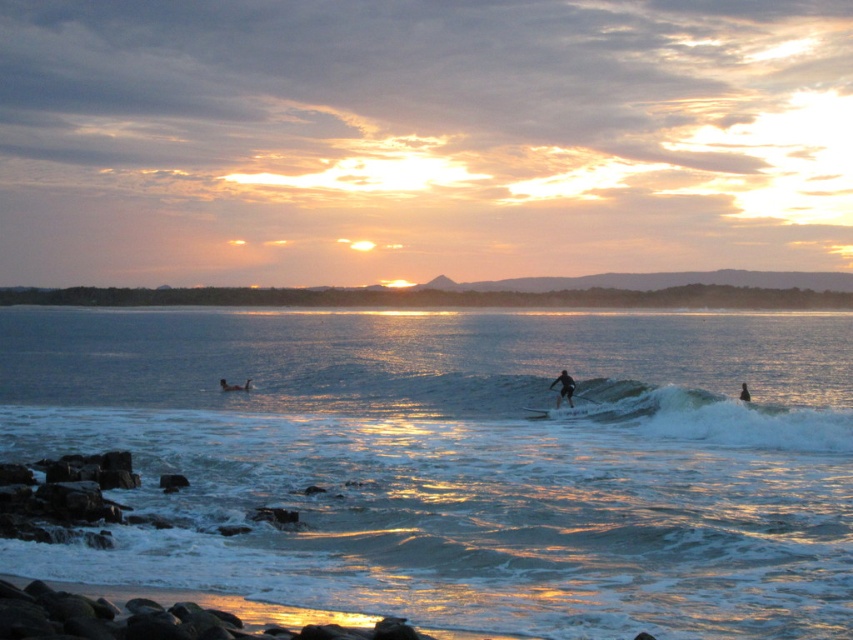
Which is behind, point (448, 346) or point (577, 408)?

Positioned behind is point (448, 346).

Does clear water at center have a greater height compared to white foam surfboard at center?

Yes.

Is point (61, 364) closer to viewer compared to point (564, 410)?

No, (61, 364) is behind (564, 410).

Where is `clear water at center`? This screenshot has width=853, height=640. clear water at center is located at coordinates (460, 461).

The height and width of the screenshot is (640, 853). I want to click on white foam surfboard at center, so click(561, 412).

Is white foam surfboard at center positioned behind smooth skin person at center?

No, white foam surfboard at center is closer to the viewer.

Is point (524, 408) more distant than point (245, 388)?

That is False.

You are a GUI agent. You are given a task and a screenshot of the screen. Output one action in this format:
    pyautogui.click(x=<x>, y=<y>)
    Task: Click on the white foam surfboard at center
    Image resolution: width=853 pixels, height=640 pixels.
    Given the screenshot: What is the action you would take?
    pyautogui.click(x=561, y=412)

Who is taller, clear water at center or smooth skin person at center?

Standing taller between the two is clear water at center.

Can you confirm if clear water at center is taller than smooth skin person at center?

Yes, clear water at center is taller than smooth skin person at center.

Does point (370, 512) lie behind point (248, 381)?

No, it is in front of (248, 381).

What are the coordinates of `clear water at center` in the screenshot? It's located at (460, 461).